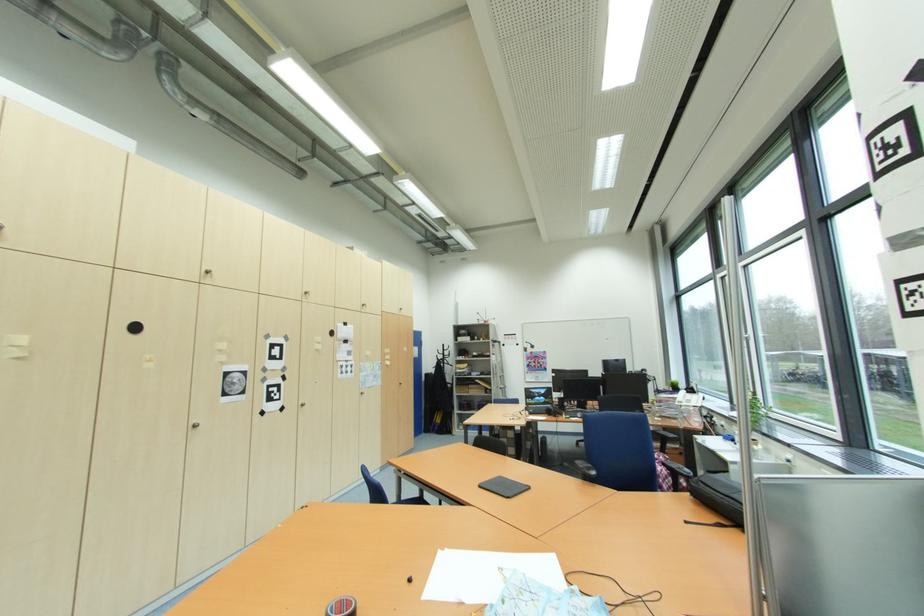
Find where to open the closed black laptop. Please return your answer as a coordinate pair (x, y).

(504, 485)